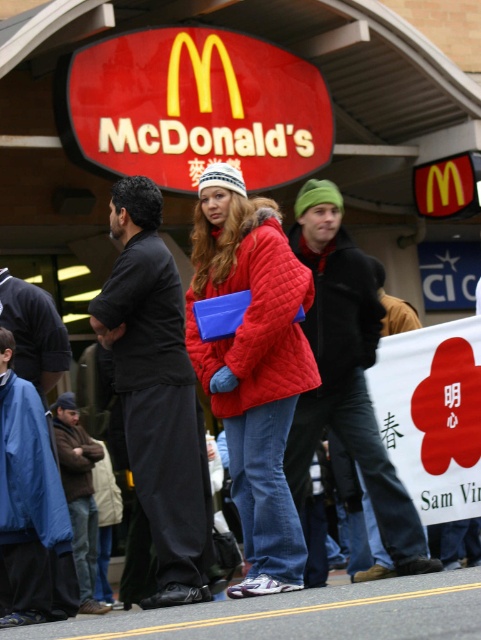
Question: Can you confirm if green knit hat at center is smaller than brown woolen jacket at lower left?

Choices:
 (A) yes
 (B) no

Answer: (A)

Question: Which of the following is the farthest from the observer?

Choices:
 (A) (163, 260)
 (B) (91, 554)
 (C) (293, 236)
 (D) (244, 460)

Answer: (B)

Question: Is quilted red coat at center in front of green knit hat at center?

Choices:
 (A) yes
 (B) no

Answer: (A)

Question: Which of the following is the closest to the observer?

Choices:
 (A) (91, 572)
 (B) (147, 372)

Answer: (B)

Question: Can you confirm if black matte shirt at center is positioned to the left of green knit hat at center?

Choices:
 (A) yes
 (B) no

Answer: (A)

Question: Which object is closer to the camera taking this photo?

Choices:
 (A) brown woolen jacket at lower left
 (B) black matte shirt at center
 (C) green knit hat at center
 (D) quilted red coat at center

Answer: (D)